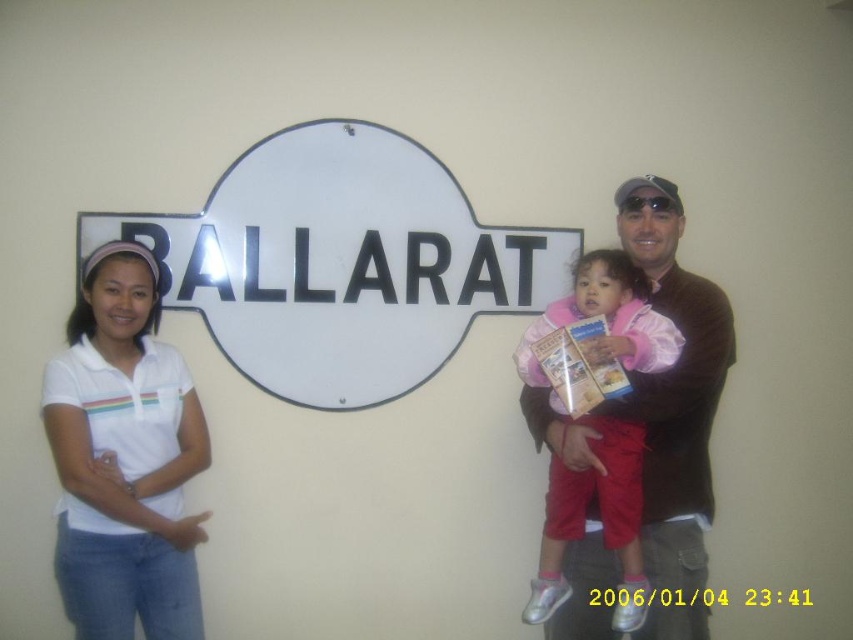
Question: Which of the following is the closest to the observer?

Choices:
 (A) white cotton shirt at left
 (B) brown sweater at center

Answer: (A)

Question: Is white cotton shirt at left above brown sweater at center?

Choices:
 (A) yes
 (B) no

Answer: (B)

Question: Which of the following is the closest to the observer?

Choices:
 (A) (148, 468)
 (B) (555, 451)

Answer: (A)

Question: Which point appears closest to the camera in this image?

Choices:
 (A) (192, 433)
 (B) (689, 276)

Answer: (A)

Question: From the image, what is the correct spatial relationship of white cotton shirt at left in relation to brown sweater at center?

Choices:
 (A) right
 (B) left

Answer: (B)

Question: Can you confirm if white cotton shirt at left is positioned to the left of brown sweater at center?

Choices:
 (A) no
 (B) yes

Answer: (B)